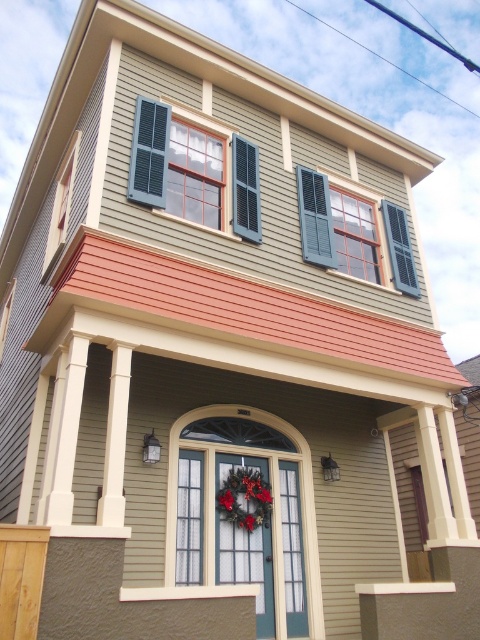
Question: Is smooth wood porch at center above matte gray window at upper left?

Choices:
 (A) yes
 (B) no

Answer: (B)

Question: Considering the real-world distances, which object is closest to the matte blue shutters at upper center?

Choices:
 (A) matte black shutters at center
 (B) matte gray window at upper left
 (C) smooth wood porch at center

Answer: (A)

Question: Can you confirm if matte blue shutters at upper center is bigger than green fabric wreath at center?

Choices:
 (A) no
 (B) yes

Answer: (B)

Question: Which point appears closest to the camera in this image?

Choices:
 (A) (178, 131)
 (B) (369, 634)
 (C) (64, 180)
 (D) (251, 493)

Answer: (B)

Question: Is smooth wood porch at center below green fabric wreath at center?

Choices:
 (A) no
 (B) yes

Answer: (A)

Question: Which of the following is the farthest from the observer?

Choices:
 (A) (365, 493)
 (B) (267, 502)
 (C) (330, 241)
 (D) (156, 136)

Answer: (A)